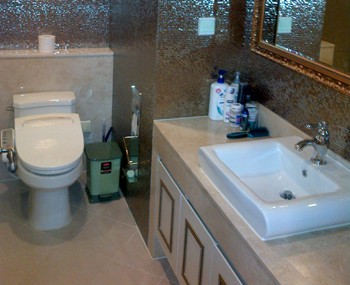
Where is `bidet`? The height and width of the screenshot is (285, 350). bidet is located at coordinates (4, 142).